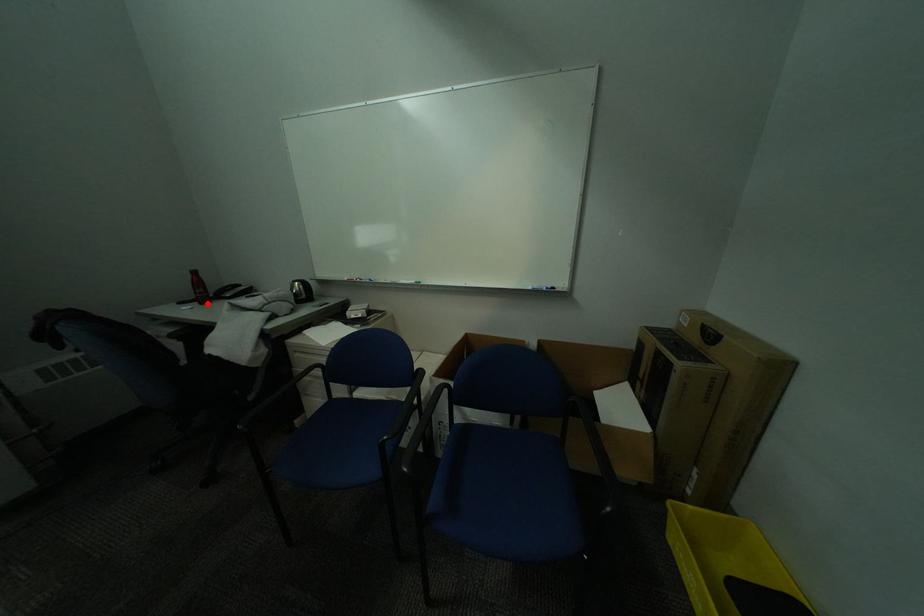
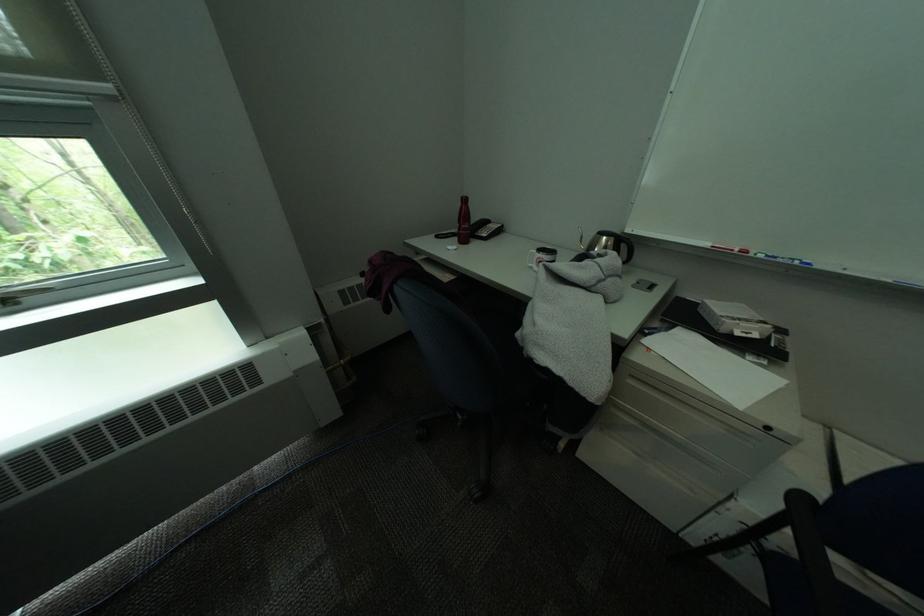
Question: I am providing you with two images of the same scene from different viewpoints. A red point is shown in image1. For the corresponding object point in image2, is it positioned nearer or farther from the camera?

Choices:
 (A) Nearer
 (B) Farther

Answer: (A)